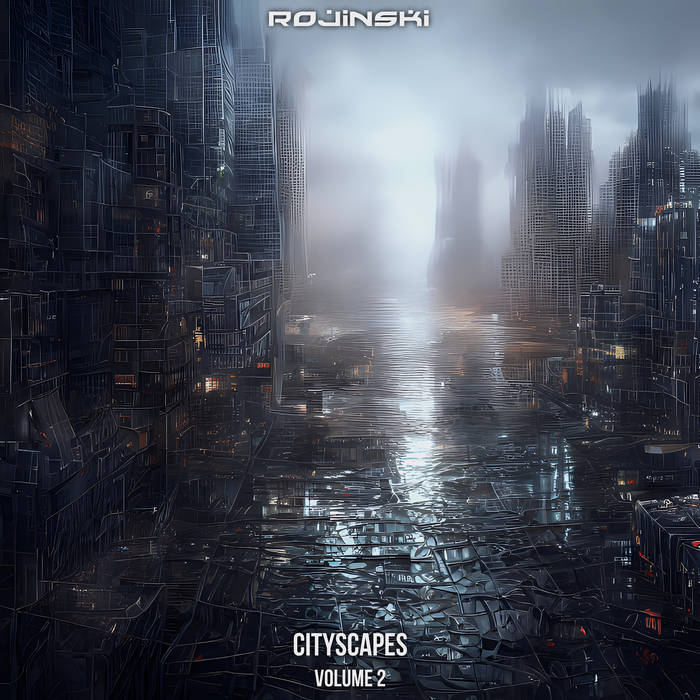
The image size is (700, 700). I want to click on lights from inside buildings, so click(206, 381), click(610, 349), click(652, 617), click(637, 553), click(195, 335).